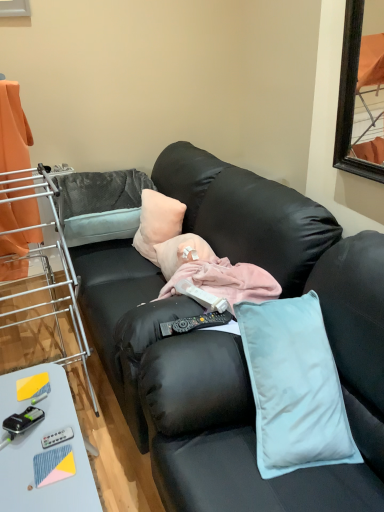
Question: From a real-world perspective, is metal/brushed metal laundry rack at left located beneath peachy soft pillow at center?

Choices:
 (A) yes
 (B) no

Answer: (B)

Question: Is metal/brushed metal laundry rack at left oriented away from peachy soft pillow at center?

Choices:
 (A) no
 (B) yes

Answer: (B)

Question: Are metal/brushed metal laundry rack at left and peachy soft pillow at center located far from each other?

Choices:
 (A) yes
 (B) no

Answer: (B)

Question: From the image's perspective, is metal/brushed metal laundry rack at left below peachy soft pillow at center?

Choices:
 (A) yes
 (B) no

Answer: (A)

Question: Does metal/brushed metal laundry rack at left have a greater height compared to peachy soft pillow at center?

Choices:
 (A) no
 (B) yes

Answer: (B)

Question: Is orange fabric curtain at left inside or outside of light blue plastic table at lower left?

Choices:
 (A) outside
 (B) inside

Answer: (A)

Question: From a real-world perspective, is orange fabric curtain at left positioned above or below light blue plastic table at lower left?

Choices:
 (A) below
 (B) above

Answer: (B)

Question: In the image, is orange fabric curtain at left on the left side or the right side of light blue plastic table at lower left?

Choices:
 (A) right
 (B) left

Answer: (B)

Question: From the image's perspective, is orange fabric curtain at left above or below light blue plastic table at lower left?

Choices:
 (A) above
 (B) below

Answer: (A)

Question: Considering the positions of point (24, 332) and point (175, 330), is point (24, 332) closer or farther from the camera than point (175, 330)?

Choices:
 (A) closer
 (B) farther

Answer: (B)

Question: Visually, is metal/brushed metal laundry rack at left positioned to the left or to the right of black plastic remote control at center?

Choices:
 (A) right
 (B) left

Answer: (B)

Question: In terms of height, does metal/brushed metal laundry rack at left look taller or shorter compared to black plastic remote control at center?

Choices:
 (A) short
 (B) tall

Answer: (B)

Question: In the image, is metal/brushed metal laundry rack at left positioned in front of or behind black plastic remote control at center?

Choices:
 (A) front
 (B) behind

Answer: (A)

Question: From their relative heights in the image, would you say peachy soft pillow at center is taller or shorter than orange fabric curtain at left?

Choices:
 (A) tall
 (B) short

Answer: (B)

Question: Considering the relative positions of peachy soft pillow at center and orange fabric curtain at left in the image provided, is peachy soft pillow at center to the left or to the right of orange fabric curtain at left?

Choices:
 (A) right
 (B) left

Answer: (A)